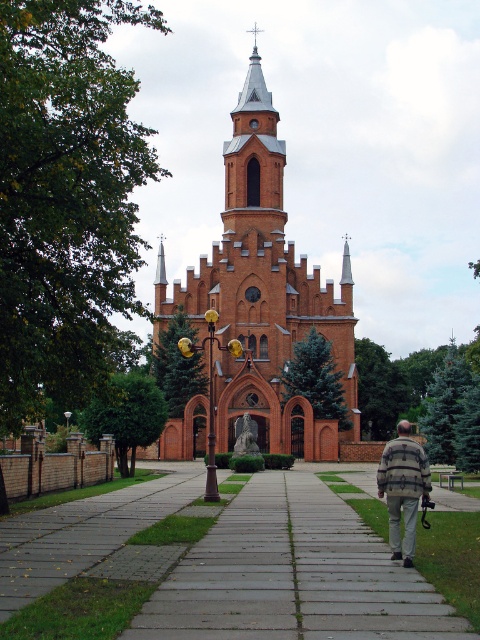
Between brick church at center and gray concrete pavement at center, which one is positioned higher?

brick church at center

Is brick church at center positioned in front of gray concrete pavement at center?

No.

Which is behind, point (205, 412) or point (297, 627)?

Point (205, 412)

You are a GUI agent. You are given a task and a screenshot of the screen. Output one action in this format:
    pyautogui.click(x=<x>, y=<y>)
    Task: Click on the brick church at center
    Image resolution: width=480 pixels, height=640 pixels.
    Given the screenshot: What is the action you would take?
    pyautogui.click(x=264, y=292)

Does point (158, 586) lie in front of point (398, 477)?

Yes, it is in front of point (398, 477).

How far apart are gray concrete pavement at center and striped fabric jacket at center?

gray concrete pavement at center is 41.96 feet away from striped fabric jacket at center.

Is point (312, 568) farther from viewer compared to point (381, 476)?

No, it is in front of (381, 476).

Where is `gray concrete pavement at center`? This screenshot has height=640, width=480. gray concrete pavement at center is located at coordinates (294, 576).

Does brick church at center have a lesser width compared to striped fabric jacket at center?

No, brick church at center is not thinner than striped fabric jacket at center.

Looking at this image, does brick church at center appear over striped fabric jacket at center?

Indeed, brick church at center is positioned over striped fabric jacket at center.

Which is in front, point (297, 317) or point (409, 536)?

Positioned in front is point (409, 536).

What are the coordinates of `brick church at center` in the screenshot? It's located at click(264, 292).